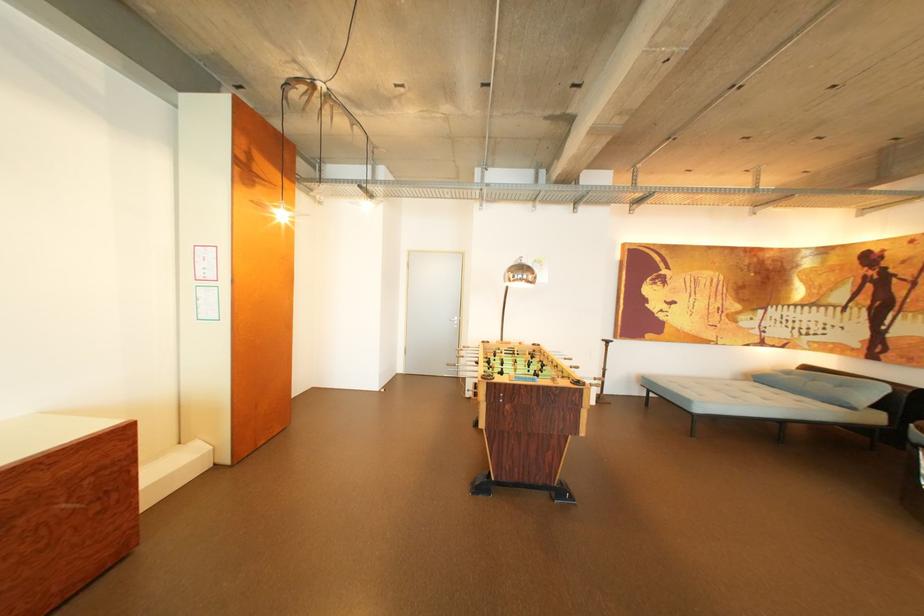
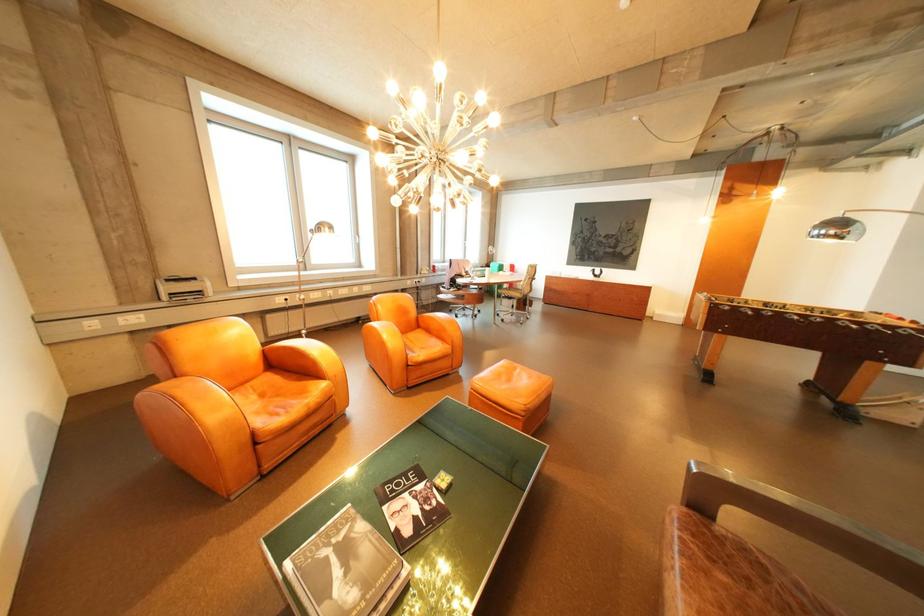
Find the pixel in the second image that matches (x=542, y=278) in the first image.

(846, 233)